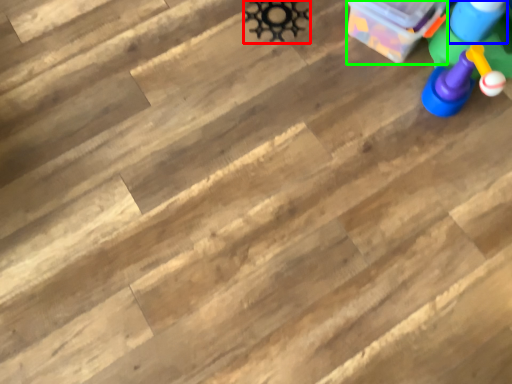
Question: Which object is positioned closest to toy (highlighted by a red box)? Select from toy (highlighted by a blue box) and cardboard box (highlighted by a green box).

Choices:
 (A) toy
 (B) cardboard box

Answer: (B)